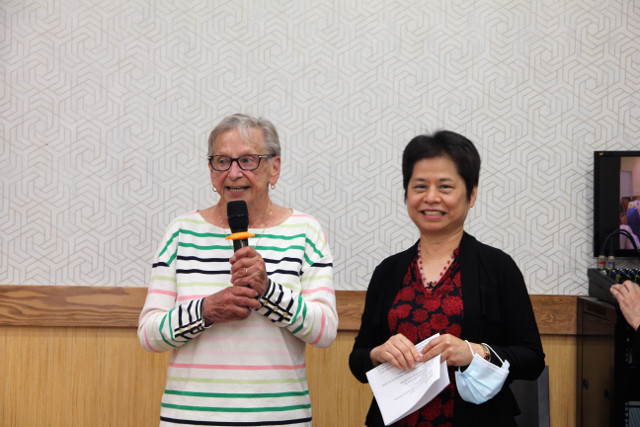
This screenshot has width=640, height=427. Find the location of `wood wall`. wood wall is located at coordinates (68, 406), (562, 368), (336, 368).